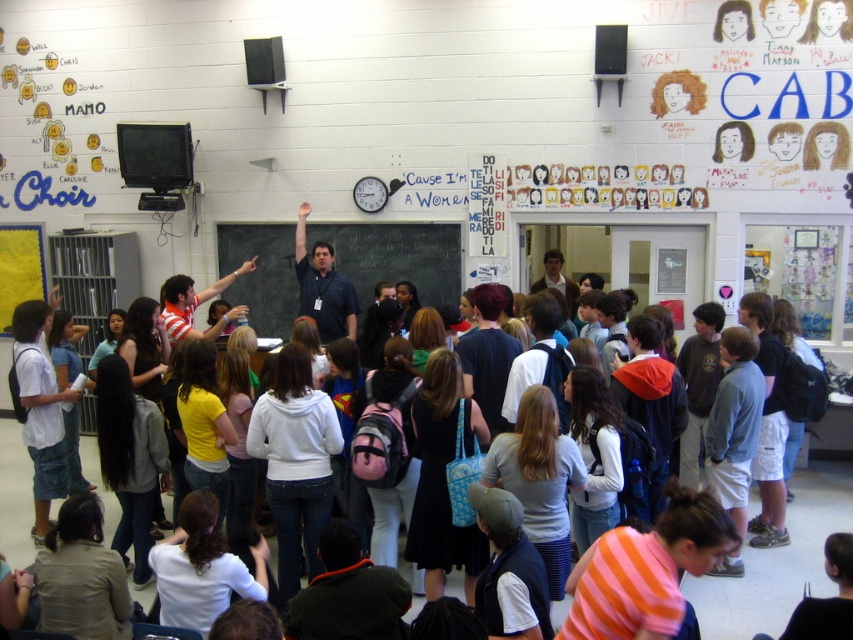
Is white cotton hoodie at center above matte blue shirt at center?

→ No, white cotton hoodie at center is not above matte blue shirt at center.

Based on the photo, can you confirm if white cotton hoodie at center is positioned to the right of matte blue shirt at center?

Yes, white cotton hoodie at center is to the right of matte blue shirt at center.

At what (x,y) coordinates should I click in order to perform the action: click on white cotton hoodie at center. Please return your answer as a coordinate pair (x, y). Looking at the image, I should click on (778, 563).

Can you confirm if white cotton hoodie at center is smaller than blackboard at center?

No.

Can you confirm if white cotton hoodie at center is taller than blackboard at center?

Yes, white cotton hoodie at center is taller than blackboard at center.

Does point (26, 518) lie in front of point (276, 289)?

Yes, it is.

The height and width of the screenshot is (640, 853). I want to click on white cotton hoodie at center, so click(x=778, y=563).

Can you confirm if blackboard at center is taller than matte blue shirt at center?

No, blackboard at center is not taller than matte blue shirt at center.

Between point (234, 237) and point (297, 253), which one is positioned in front?

Point (297, 253)

Which is in front, point (421, 292) or point (306, 288)?

Point (306, 288) is more forward.

This screenshot has height=640, width=853. Identify the location of blackboard at center. (395, 257).